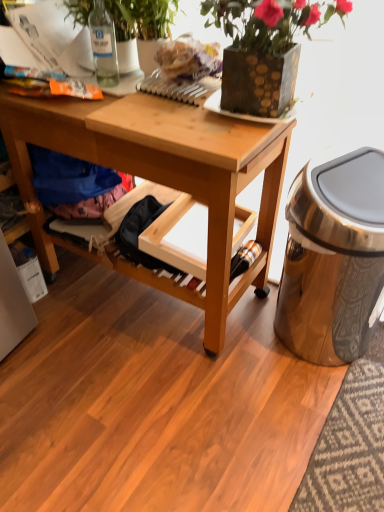
This screenshot has height=512, width=384. What do you see at coordinates (333, 257) in the screenshot? I see `polished metallic trash can at right` at bounding box center [333, 257].

You are a GUI agent. You are given a task and a screenshot of the screen. Output one action in this format:
    pyautogui.click(x=<x>, y=<y>)
    Task: Click on the wooden drawer at center
    Image resolution: width=384 pixels, height=512 pixels.
    Given the screenshot: What is the action you would take?
    pyautogui.click(x=180, y=237)

Image resolution: width=384 pixels, height=512 pixels. What do you see at coordinates (189, 58) in the screenshot? I see `matte plastic bag at upper center` at bounding box center [189, 58].

What is the approximate height of textured brown vase at upper center, the second houseplant from the left?

textured brown vase at upper center, the second houseplant from the left, is 11.70 inches in height.

Find the location of a particular element. polished metallic trash can at right is located at coordinates (333, 257).

Consider the image. From the image's perspective, is wooden drawer at center above wooden desk at center?

Incorrect, from the image's perspective, wooden drawer at center is lower than wooden desk at center.

From the picture: Can wooden desk at center be found inside wooden drawer at center?

That's incorrect, wooden desk at center is not inside wooden drawer at center.

From a real-world perspective, between wooden drawer at center and wooden desk at center, who is vertically higher?

From a 3D spatial view, wooden desk at center is above.

Is polished metallic trash can at right positioned before wooden desk at center?

No, polished metallic trash can at right is further to the viewer.

Does point (299, 262) come in front of point (23, 101)?

No, it is behind (23, 101).

From the image's perspective, is polished metallic trash can at right over wooden desk at center?

No, from the image's perspective, polished metallic trash can at right is not on top of wooden desk at center.

Measure the distance between polished metallic trash can at right and wooden desk at center.

The distance of polished metallic trash can at right from wooden desk at center is 14.91 inches.

Which object is closer to the camera, polished metallic trash can at right or wooden drawer at center?

polished metallic trash can at right is closer to the camera.

Consider the image. Between polished metallic trash can at right and wooden drawer at center, which one has larger width?

wooden drawer at center is wider.

How many degrees apart are the facing directions of polished metallic trash can at right and wooden drawer at center?

10.6 degrees separate the facing orientations of polished metallic trash can at right and wooden drawer at center.

Is wooden drawer at center located within polished metallic trash can at right?

Definitely not — wooden drawer at center is not inside polished metallic trash can at right.

Looking at their sizes, would you say wooden desk at center is wider or thinner than polished metallic trash can at right?

Considering their sizes, wooden desk at center looks broader than polished metallic trash can at right.

In the image, is wooden desk at center on the left side or the right side of polished metallic trash can at right?

From the image, it's evident that wooden desk at center is to the left of polished metallic trash can at right.

Identify the location of desk lying in front of the polished metallic trash can at right. This screenshot has width=384, height=512. (166, 174).

From a real-world perspective, is wooden desk at center positioned under polished metallic trash can at right based on gravity?

No.

Is green leafy plant at upper center, positioned as the second houseplant in right-to-left order, placed right next to polished metallic trash can at right?

No, green leafy plant at upper center, positioned as the second houseplant in right-to-left order, is not making contact with polished metallic trash can at right.

Who is taller, green leafy plant at upper center, positioned as the second houseplant in right-to-left order, or polished metallic trash can at right?

Standing taller between the two is polished metallic trash can at right.

Considering the sizes of objects green leafy plant at upper center, positioned as the second houseplant in right-to-left order, and polished metallic trash can at right in the image provided, who is bigger, green leafy plant at upper center, positioned as the second houseplant in right-to-left order, or polished metallic trash can at right?

polished metallic trash can at right.

From the image's perspective, which object appears higher, green leafy plant at upper center, positioned as the second houseplant in right-to-left order, or polished metallic trash can at right?

green leafy plant at upper center, positioned as the second houseplant in right-to-left order, appears higher in the image.

Identify the location of clothing above the wooden desk at center (from the image's perspective). (75, 184).

From the image's perspective, would you say blue fabric at lower left is positioned over wooden desk at center?

Yes, from the image's perspective, blue fabric at lower left is above wooden desk at center.

How different are the orientations of blue fabric at lower left and wooden desk at center in degrees?

1.2 degrees.

Considering the sizes of objects blue fabric at lower left and wooden desk at center in the image provided, who is shorter, blue fabric at lower left or wooden desk at center?

blue fabric at lower left.

Who is bigger, wooden desk at center or green leafy plant at upper center, positioned as the second houseplant in right-to-left order?

With larger size is wooden desk at center.

Who is taller, wooden desk at center or green leafy plant at upper center, positioned as the second houseplant in right-to-left order?

wooden desk at center is taller.

Is wooden desk at center positioned with its back to green leafy plant at upper center, the 1th houseplant positioned from the left?

No, wooden desk at center's orientation is not away from green leafy plant at upper center, the 1th houseplant positioned from the left.

From the picture: Does wooden desk at center have a lesser width compared to green leafy plant at upper center, the 1th houseplant positioned from the left?

No.

At what (x,y) coordinates should I click in order to perform the action: click on desk above the wooden drawer at center (from the image's perspective). Please return your answer as a coordinate pair (x, y). Image resolution: width=384 pixels, height=512 pixels. Looking at the image, I should click on (166, 174).

The width and height of the screenshot is (384, 512). Find the location of `desk in front of the polished metallic trash can at right`. desk in front of the polished metallic trash can at right is located at coordinates (166, 174).

When comparing their distances from polished metallic trash can at right, does green leafy plant at upper center, the 1th houseplant positioned from the left, or wooden drawer at center seem closer?

Based on the image, wooden drawer at center appears to be nearer to polished metallic trash can at right.

From the image, which object appears to be farther from green leafy plant at upper center, the 1th houseplant positioned from the left, clear glass bottle at upper left or matte plastic bag at upper center?

The object further to green leafy plant at upper center, the 1th houseplant positioned from the left, is matte plastic bag at upper center.

Looking at the image, which one is located further to polished metallic trash can at right, wooden drawer at center or blue fabric at lower left?

blue fabric at lower left lies further to polished metallic trash can at right than the other object.

From the image, which object appears to be farther from wooden drawer at center, clear glass bottle at upper left or matte plastic bag at upper center?

clear glass bottle at upper left.

Looking at this image, estimate the real-world distances between objects in this image. Which object is closer to blue fabric at lower left, green leafy plant at upper center, positioned as the second houseplant in right-to-left order, or textured brown vase at upper center, the first houseplant in the right-to-left sequence?

Based on the image, green leafy plant at upper center, positioned as the second houseplant in right-to-left order, appears to be nearer to blue fabric at lower left.

When comparing their distances from polished metallic trash can at right, does matte plastic bag at upper center or wooden drawer at center seem closer?

Among the two, wooden drawer at center is located nearer to polished metallic trash can at right.

When comparing their distances from polished metallic trash can at right, does wooden drawer at center or textured brown vase at upper center, the first houseplant in the right-to-left sequence, seem further?

textured brown vase at upper center, the first houseplant in the right-to-left sequence, is further to polished metallic trash can at right.

From the picture: Considering their positions, is polished metallic trash can at right positioned closer to clear glass bottle at upper left than wooden drawer at center?

wooden drawer at center is positioned closer to the anchor clear glass bottle at upper left.

This screenshot has width=384, height=512. In order to click on desk between green leafy plant at upper center, the 1th houseplant positioned from the left, and polished metallic trash can at right, in the vertical direction in this screenshot , I will do `click(166, 174)`.

This screenshot has height=512, width=384. Identify the location of desk between blue fabric at lower left and matte plastic bag at upper center from left to right. (166, 174).

Where is `food between blue fabric at lower left and textured brown vase at upper center, the second houseplant from the left, from left to right`? The image size is (384, 512). food between blue fabric at lower left and textured brown vase at upper center, the second houseplant from the left, from left to right is located at coordinates (189, 58).

Where is `bottle situated between blue fabric at lower left and polished metallic trash can at right from left to right`? The image size is (384, 512). bottle situated between blue fabric at lower left and polished metallic trash can at right from left to right is located at coordinates (103, 45).